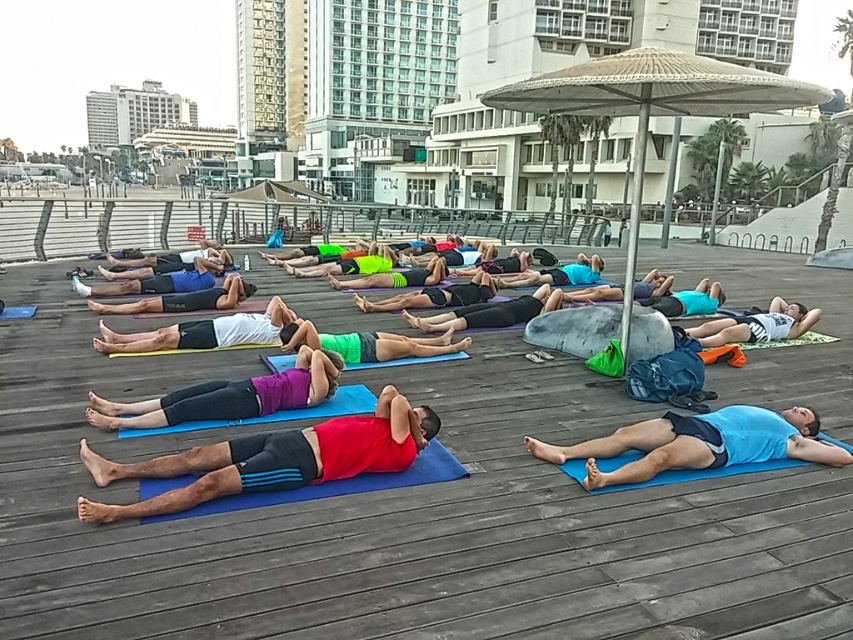
Can you confirm if blue matte yoga mat at lower right is wider than purple matte yoga mat at center?

Indeed, blue matte yoga mat at lower right has a greater width compared to purple matte yoga mat at center.

Image resolution: width=853 pixels, height=640 pixels. Describe the element at coordinates (698, 444) in the screenshot. I see `blue matte yoga mat at lower right` at that location.

Identify the location of blue matte yoga mat at lower right. The width and height of the screenshot is (853, 640). (698, 444).

At what (x,y) coordinates should I click in order to perform the action: click on blue rubber mat at center. Please return your answer as a coordinate pair (x, y). This screenshot has height=640, width=853. Looking at the image, I should click on (399, 516).

Does blue rubber mat at center have a greater width compared to white cotton shirt at center?

Indeed, blue rubber mat at center has a greater width compared to white cotton shirt at center.

Is point (498, 557) positioned after point (750, 314)?

No, it is not.

Find the location of `blue rubber mat at center`. blue rubber mat at center is located at coordinates (399, 516).

Which is in front, point (184, 416) or point (352, 340)?

Point (184, 416) is more forward.

Is purple matte yoga mat at center above green fabric shorts at center?

Actually, purple matte yoga mat at center is below green fabric shorts at center.

Who is more forward, (86,419) or (462,342)?

Positioned in front is point (86,419).

Where is `purple matte yoga mat at center`? purple matte yoga mat at center is located at coordinates (227, 396).